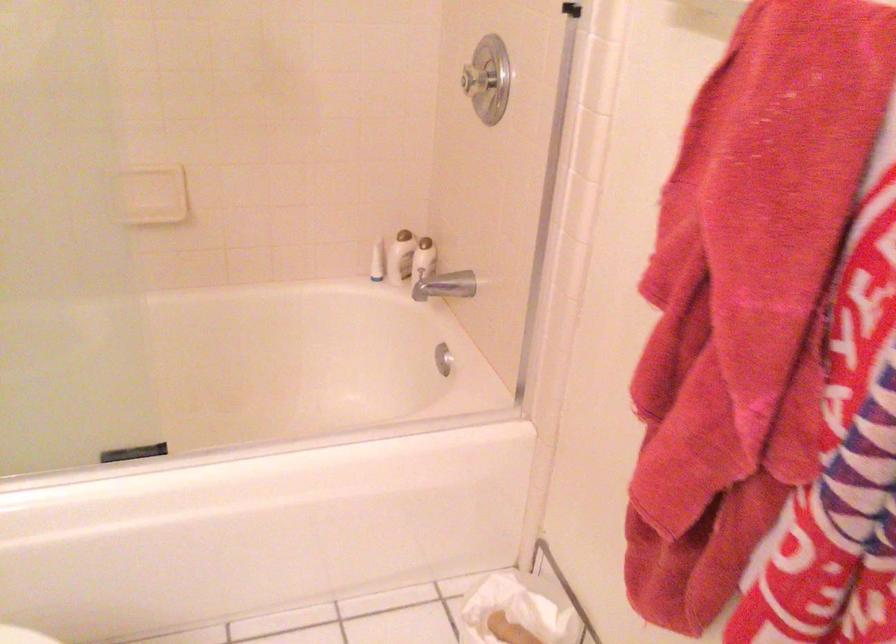
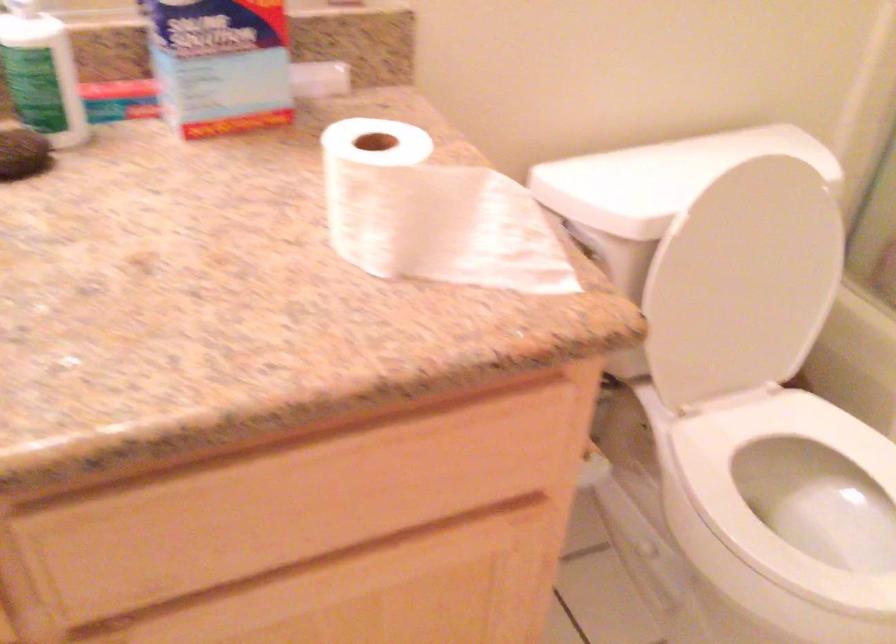
First-person continuous shooting, in which direction is the camera rotating?

The camera's rotation is toward left-down.